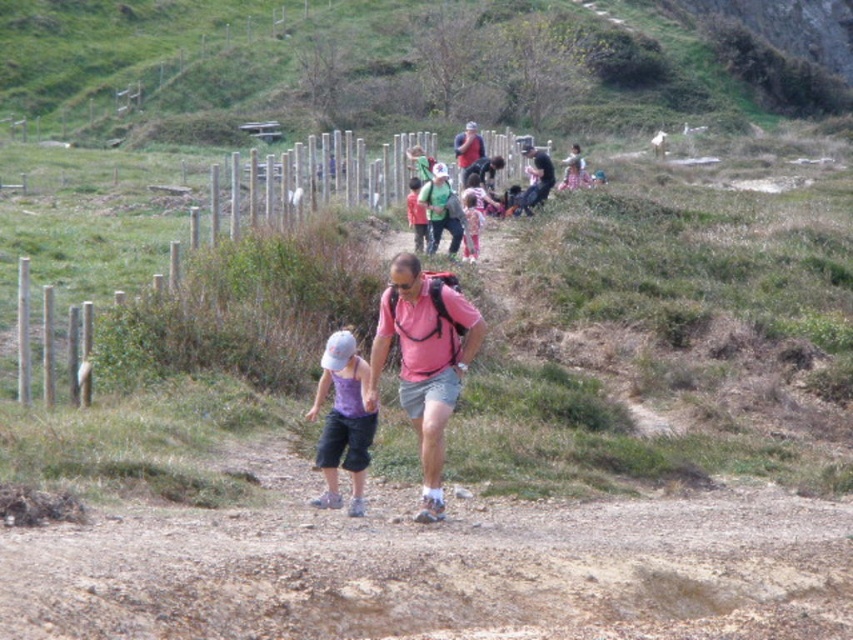
Who is more forward, (x=427, y=513) or (x=432, y=250)?

Positioned in front is point (x=427, y=513).

Which is in front, point (421, 323) or point (518, 148)?

Point (421, 323) is more forward.

Locate an element on the screen. matte pink shirt at center is located at coordinates (424, 362).

Can you confirm if matte pink shirt at center is positioned below light purple fabric shirt at center?

No.

Does point (416, 388) lie in front of point (343, 397)?

No, it is not.

Locate an element on the screen. The image size is (853, 640). matte pink shirt at center is located at coordinates (424, 362).

What do you see at coordinates (343, 420) in the screenshot? I see `light purple fabric shirt at center` at bounding box center [343, 420].

Between point (358, 374) and point (509, 193), which one is positioned in front?

Positioned in front is point (358, 374).

Is point (354, 362) closer to camera compared to point (546, 147)?

Yes, point (354, 362) is closer to viewer.

The width and height of the screenshot is (853, 640). In order to click on light purple fabric shirt at center in this screenshot , I will do `click(343, 420)`.